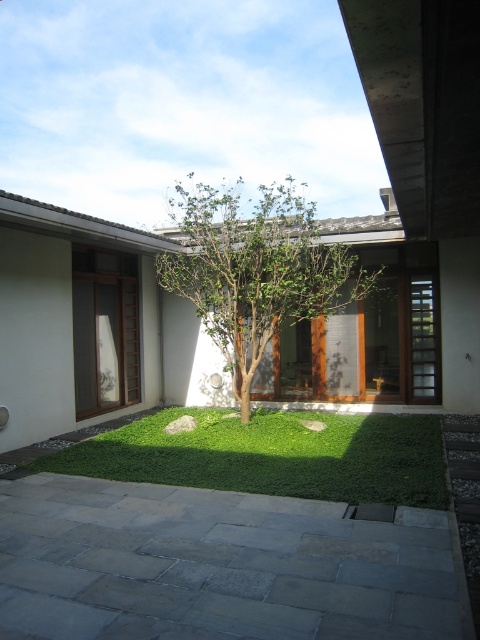
You are a gardener who needs to water both the green leafy grass at center and the green leafy tree at center in the courtyard. If your watering can holds enough water to cover 10 meters, can you water both without needing to refill?

The distance between the green leafy grass at center and the green leafy tree at center is 8.38 meters. Since the watering can can cover 10 meters, you can water both without needing to refill.